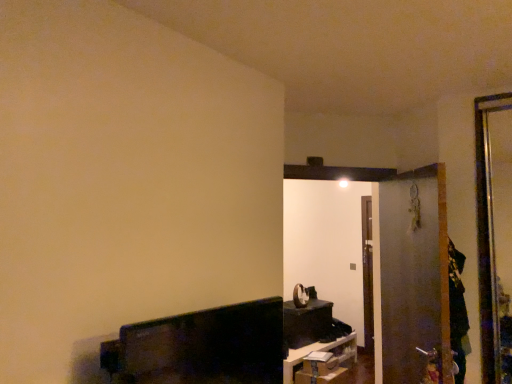
Question: Considering their positions, is transparent plastic screen door at right located in front of or behind matte black shelf at lower center, which appears as the 3th furniture when viewed from the top?

Choices:
 (A) front
 (B) behind

Answer: (A)

Question: Considering the positions of transparent plastic screen door at right and matte black shelf at lower center, the second furniture in the front-to-back sequence, in the image, is transparent plastic screen door at right bigger or smaller than matte black shelf at lower center, the second furniture in the front-to-back sequence,?

Choices:
 (A) small
 (B) big

Answer: (A)

Question: Considering the real-world distances, which object is closest to the matte black tv at lower left, the third furniture positioned from the back?

Choices:
 (A) matte black clock at center, the 3th furniture in the front-to-back sequence
 (B) matte black shelf at lower center, which is the first furniture from bottom to top
 (C) transparent plastic screen door at right

Answer: (C)

Question: Considering the real-world distances, which object is farthest from the matte black tv at lower left, the first furniture viewed from the front?

Choices:
 (A) matte black shelf at lower center, which appears as the 3th furniture when viewed from the top
 (B) transparent plastic screen door at right
 (C) matte black clock at center, the 3th furniture in the front-to-back sequence

Answer: (C)